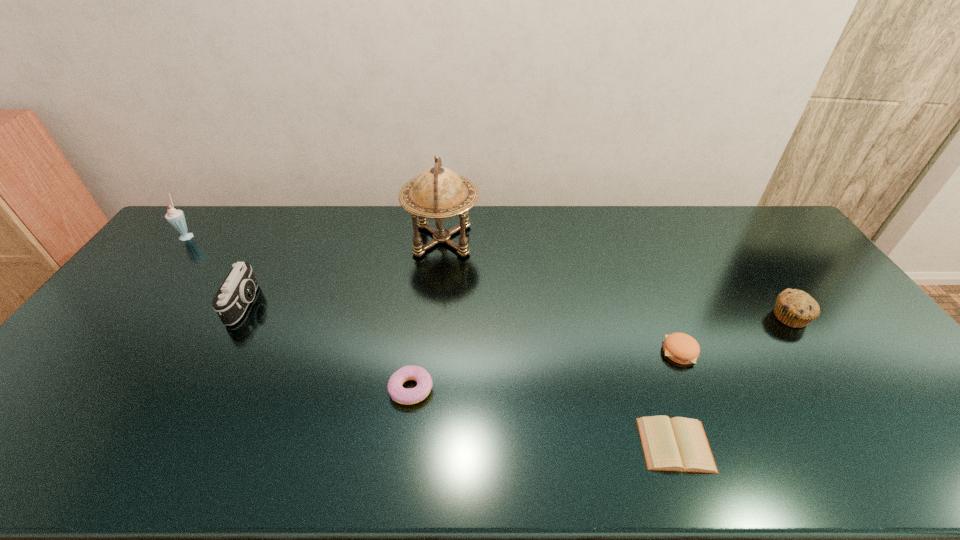
Select which object is the third closest to the third tallest object. Please provide its 2D coordinates. Your answer should be formatted as a tuple, i.e. [(x, y)], where the tuple contains the x and y coordinates of a point satisfying the conditions above.

[(399, 394)]

This screenshot has height=540, width=960. I want to click on free location that satisfies the following two spatial constraints: 1. on the front-facing side of the globe; 2. on the back side of the patty, so click(431, 352).

The width and height of the screenshot is (960, 540). Identify the location of free location that satisfies the following two spatial constraints: 1. on the front-facing side of the tallest object; 2. on the back side of the fourth shortest object. (434, 316).

This screenshot has width=960, height=540. Identify the location of free space in the image that satisfies the following two spatial constraints: 1. on the front-facing side of the tallest object; 2. on the left side of the fourth shortest object. (434, 316).

Identify the location of vacant area in the image that satisfies the following two spatial constraints: 1. on the back side of the patty; 2. on the right side of the fourth tallest object. This screenshot has width=960, height=540. (664, 316).

I want to click on vacant space that satisfies the following two spatial constraints: 1. on the back side of the muffin; 2. on the front lens of the sixth object from right to left, so click(x=781, y=304).

Locate an element on the screen. The width and height of the screenshot is (960, 540). vacant point that satisfies the following two spatial constraints: 1. on the straw side of the third nearest object; 2. on the right side of the second tallest object is located at coordinates (96, 352).

This screenshot has height=540, width=960. I want to click on free location that satisfies the following two spatial constraints: 1. on the straw side of the milkshake; 2. on the left side of the third nearest object, so click(96, 352).

At what (x,y) coordinates should I click in order to perform the action: click on free space that satisfies the following two spatial constraints: 1. on the straw side of the leftmost object; 2. on the back side of the fifth farthest object. Please return your answer as a coordinate pair (x, y). This screenshot has height=540, width=960. Looking at the image, I should click on (96, 352).

Where is `free location that satisfies the following two spatial constraints: 1. on the front lens of the camera; 2. on the left side of the fifth farthest object`? The image size is (960, 540). free location that satisfies the following two spatial constraints: 1. on the front lens of the camera; 2. on the left side of the fifth farthest object is located at coordinates point(220,352).